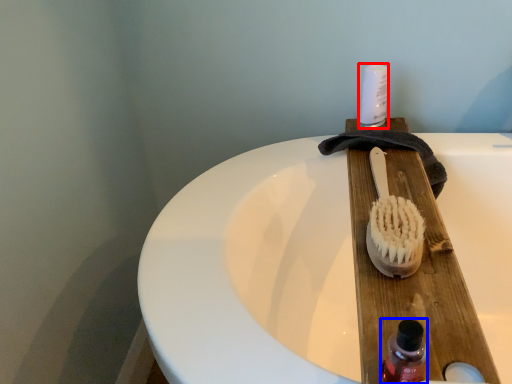
Question: Which object is closer to the camera taking this photo, toiletry (highlighted by a red box) or bottle (highlighted by a blue box)?

Choices:
 (A) toiletry
 (B) bottle

Answer: (B)